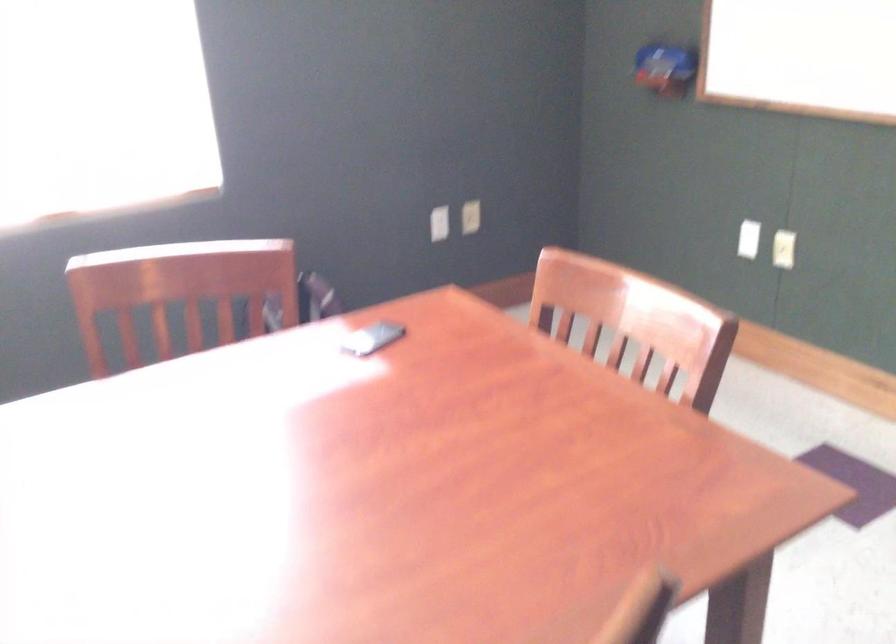
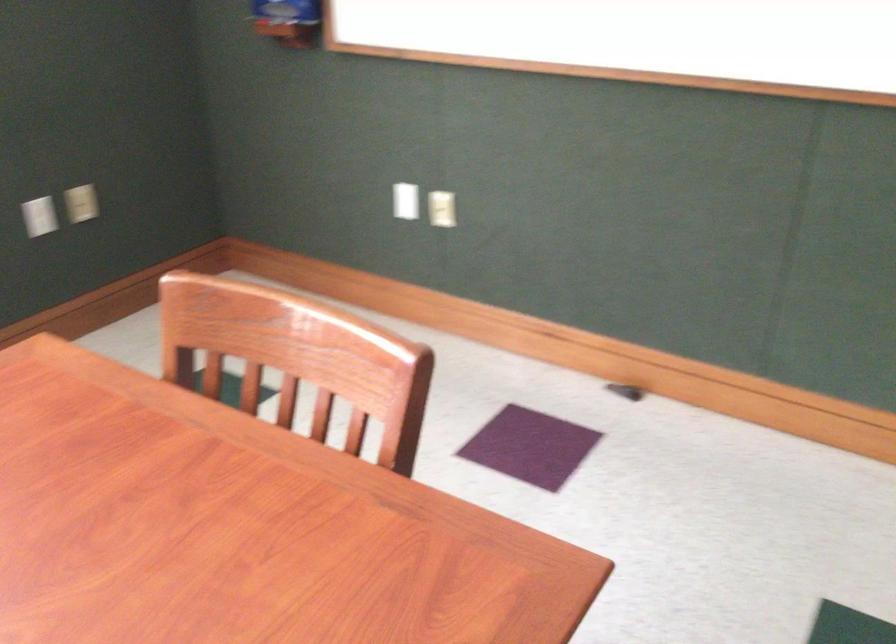
In a continuous first-person perspective shot, in which direction is the camera moving?

The cameraman walked toward right, forward.